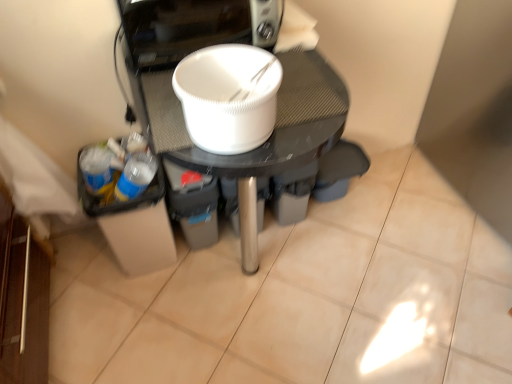
This screenshot has width=512, height=384. I want to click on spots to the right of white matte bowl at center, so (x=389, y=264).